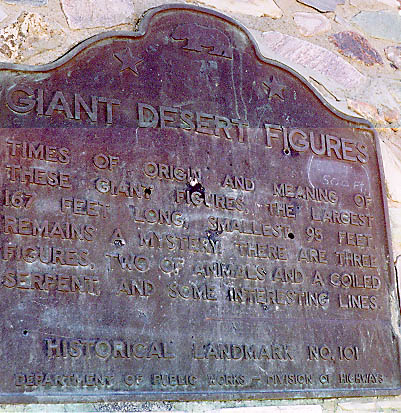
Find the location of a particular element. rock and concrete wall is located at coordinates (202, 406), (394, 183), (293, 25), (30, 28).